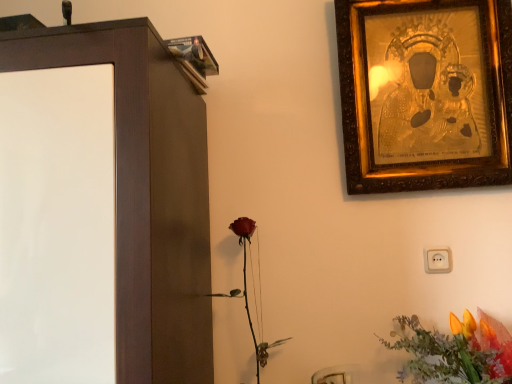
What is the approximate height of vibrant orange petals at lower right?

vibrant orange petals at lower right is 24.43 centimeters in height.

Where is `matte red rose at center`? The height and width of the screenshot is (384, 512). matte red rose at center is located at coordinates (246, 288).

What is the approximate height of gold textured picture frame at upper right?

gold textured picture frame at upper right is 27.03 inches tall.

What is the approximate width of matte brown cabinet at left?

matte brown cabinet at left is 61.11 centimeters wide.

The width and height of the screenshot is (512, 384). Find the location of `vibrant orange petals at lower right`. vibrant orange petals at lower right is located at coordinates (449, 354).

Is point (430, 55) farther from viewer compared to point (155, 87)?

Yes, it is.

Which of these two, gold textured picture frame at upper right or matte brown cabinet at left, is thinner?

gold textured picture frame at upper right.

Is gold textured picture frame at upper right not near matte brown cabinet at left?

Actually, gold textured picture frame at upper right and matte brown cabinet at left are a little close together.

Who is more distant, gold textured picture frame at upper right or matte brown cabinet at left?

gold textured picture frame at upper right is behind.

Is matte brown cabinet at left wider or thinner than matte red rose at center?

In the image, matte brown cabinet at left appears to be wider than matte red rose at center.

From the image's perspective, does matte brown cabinet at left appear higher than matte red rose at center?

Indeed, from the image's perspective, matte brown cabinet at left is shown above matte red rose at center.

Considering the sizes of objects matte brown cabinet at left and matte red rose at center in the image provided, who is taller, matte brown cabinet at left or matte red rose at center?

matte brown cabinet at left.

Does point (207, 319) lie behind point (217, 294)?

Yes, point (207, 319) is behind point (217, 294).

Which is behind, point (424, 378) or point (252, 334)?

Positioned behind is point (252, 334).

Would you say matte red rose at center is part of vibrant orange petals at lower right's contents?

Definitely not — matte red rose at center is not inside vibrant orange petals at lower right.

Considering the relative sizes of vibrant orange petals at lower right and matte red rose at center in the image provided, is vibrant orange petals at lower right shorter than matte red rose at center?

Yes.

Is vibrant orange petals at lower right bigger or smaller than matte red rose at center?

In the image, vibrant orange petals at lower right appears to be larger than matte red rose at center.

Based on their sizes in the image, would you say vibrant orange petals at lower right is bigger or smaller than matte brown cabinet at left?

In the image, vibrant orange petals at lower right appears to be smaller than matte brown cabinet at left.

Would you say vibrant orange petals at lower right is outside matte brown cabinet at left?

Yes.

Identify the location of flower behind the matte brown cabinet at left. The image size is (512, 384). (449, 354).

Does point (499, 363) come behind point (24, 55)?

Yes, it is behind point (24, 55).

Which object is positioned more to the right, gold textured picture frame at upper right or matte red rose at center?

From the viewer's perspective, gold textured picture frame at upper right appears more on the right side.

The image size is (512, 384). I want to click on plant that appears below the gold textured picture frame at upper right (from the image's perspective), so click(x=246, y=288).

Consider the image. Which is farther from the camera, (428,68) or (251,332)?

Point (428,68)

Is matte red rose at center positioned far away from matte brown cabinet at left?

No, matte red rose at center is in close proximity to matte brown cabinet at left.

From the image's perspective, is matte red rose at center above or below matte brown cabinet at left?

Clearly, from the image's perspective, matte red rose at center is below matte brown cabinet at left.

Is matte red rose at center looking in the opposite direction of matte brown cabinet at left?

That's not correct — matte red rose at center is not looking away from matte brown cabinet at left.

Considering the positions of point (248, 218) and point (120, 141), is point (248, 218) closer or farther from the camera than point (120, 141)?

Point (248, 218) is positioned farther from the camera compared to point (120, 141).

You are a GUI agent. You are given a task and a screenshot of the screen. Output one action in this format:
    pyautogui.click(x=<x>, y=<y>)
    Task: Click on the flower below the matte brown cabinet at left (from a real-world perspective)
    The image size is (512, 384).
    Given the screenshot: What is the action you would take?
    click(449, 354)

Can you tell me how much matte brown cabinet at left and vibrant orange petals at lower right differ in facing direction?

matte brown cabinet at left and vibrant orange petals at lower right are facing 0.986 degrees away from each other.

Looking at the image, does matte brown cabinet at left seem bigger or smaller compared to vibrant orange petals at lower right?

Clearly, matte brown cabinet at left is larger in size than vibrant orange petals at lower right.

Would you say matte brown cabinet at left is inside or outside vibrant orange petals at lower right?

matte brown cabinet at left exists outside the volume of vibrant orange petals at lower right.

At what (x,y) coordinates should I click in order to perform the action: click on picture frame above the matte brown cabinet at left (from the image's perspective). Please return your answer as a coordinate pair (x, y). The height and width of the screenshot is (384, 512). Looking at the image, I should click on (425, 93).

Find the location of `furniture on the left of matte red rose at center`. furniture on the left of matte red rose at center is located at coordinates (146, 193).

Looking at the image, which one is located further to matte red rose at center, vibrant orange petals at lower right or gold textured picture frame at upper right?

gold textured picture frame at upper right.

Looking at this image, which object lies further to the anchor point gold textured picture frame at upper right, matte red rose at center or matte brown cabinet at left?

The object further to gold textured picture frame at upper right is matte brown cabinet at left.

From the image, which object appears to be farther from vibrant orange petals at lower right, matte brown cabinet at left or gold textured picture frame at upper right?

matte brown cabinet at left is further to vibrant orange petals at lower right.

From the image, which object appears to be farther from matte red rose at center, gold textured picture frame at upper right or matte brown cabinet at left?

Among the two, gold textured picture frame at upper right is located further to matte red rose at center.

Which object lies nearer to the anchor point vibrant orange petals at lower right, matte red rose at center or matte brown cabinet at left?

matte red rose at center is positioned closer to the anchor vibrant orange petals at lower right.

From the image, which object appears to be farther from matte red rose at center, matte brown cabinet at left or gold textured picture frame at upper right?

Based on the image, gold textured picture frame at upper right appears to be further to matte red rose at center.

When comparing their distances from matte red rose at center, does gold textured picture frame at upper right or vibrant orange petals at lower right seem closer?

vibrant orange petals at lower right.

Based on their spatial positions, is matte red rose at center or gold textured picture frame at upper right further from vibrant orange petals at lower right?

gold textured picture frame at upper right is further to vibrant orange petals at lower right.

What are the coordinates of `plant between matte brown cabinet at left and vibrant orange petals at lower right` in the screenshot? It's located at (246, 288).

What are the coordinates of `picture frame located between matte brown cabinet at left and vibrant orange petals at lower right in the left-right direction` in the screenshot? It's located at (425, 93).

Identify the location of plant that lies between gold textured picture frame at upper right and vibrant orange petals at lower right from top to bottom. The image size is (512, 384). (246, 288).

Find the location of a particular element. The height and width of the screenshot is (384, 512). plant between matte brown cabinet at left and gold textured picture frame at upper right in the horizontal direction is located at coordinates (246, 288).